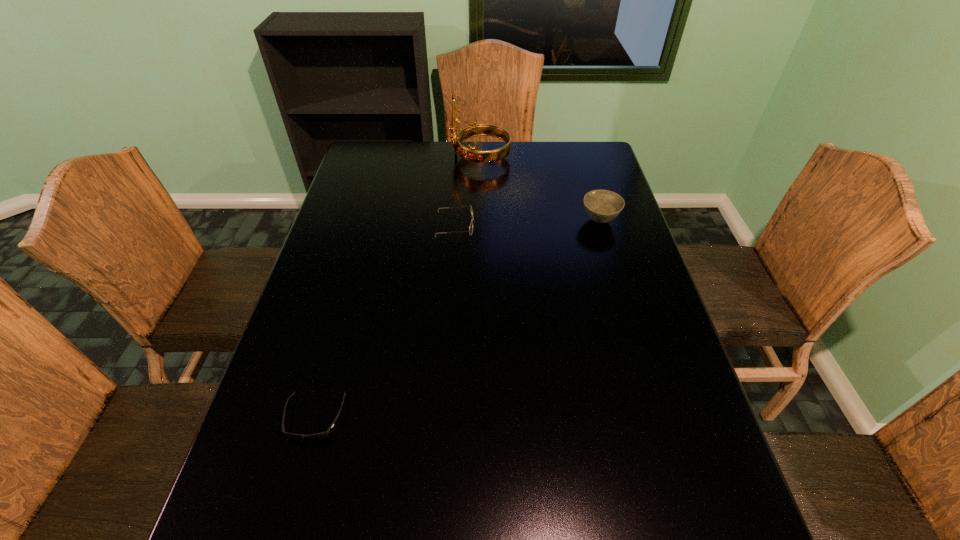
Locate an element on the screen. vacant space that's between the farthest object and the third tallest object is located at coordinates (468, 191).

Locate which object ranks in proximity to the bowl. Please provide its 2D coordinates. Your answer should be formatted as a tuple, i.e. [(x, y)], where the tuple contains the x and y coordinates of a point satisfying the conditions above.

[(473, 130)]

Identify which object is the third closest to the tiara. Please provide its 2D coordinates. Your answer should be formatted as a tuple, i.e. [(x, y)], where the tuple contains the x and y coordinates of a point satisfying the conditions above.

[(324, 434)]

I want to click on free spot that satisfies the following two spatial constraints: 1. on the front-facing side of the second shortest object; 2. on the front-facing side of the shortest object, so click(x=444, y=417).

Find the location of a particular element. vacant region that satisfies the following two spatial constraints: 1. on the front-facing side of the tiara; 2. on the right side of the bowl is located at coordinates (480, 220).

At what (x,y) coordinates should I click in order to perform the action: click on vacant position in the image that satisfies the following two spatial constraints: 1. on the front-facing side of the spectacles; 2. on the front-facing side of the shortest object. Please return your answer as a coordinate pair (x, y). Looking at the image, I should click on (444, 417).

Where is `free space that satisfies the following two spatial constraints: 1. on the front-facing side of the farthest object; 2. on the front-facing side of the leftmost object`? free space that satisfies the following two spatial constraints: 1. on the front-facing side of the farthest object; 2. on the front-facing side of the leftmost object is located at coordinates (481, 417).

The image size is (960, 540). What are the coordinates of `vacant region that satisfies the following two spatial constraints: 1. on the front-facing side of the spectacles; 2. on the front-facing side of the shortest object` in the screenshot? It's located at pyautogui.click(x=444, y=417).

You are a GUI agent. You are given a task and a screenshot of the screen. Output one action in this format:
    pyautogui.click(x=<x>, y=<y>)
    Task: Click on the free space that satisfies the following two spatial constraints: 1. on the front-facing side of the spectacles; 2. on the front-facing side of the sunglasses
    The width and height of the screenshot is (960, 540).
    Given the screenshot: What is the action you would take?
    pyautogui.click(x=444, y=417)

You are a GUI agent. You are given a task and a screenshot of the screen. Output one action in this format:
    pyautogui.click(x=<x>, y=<y>)
    Task: Click on the vacant space that satisfies the following two spatial constraints: 1. on the front-facing side of the farthest object; 2. on the front-facing side of the leftmost object
    This screenshot has height=540, width=960.
    Given the screenshot: What is the action you would take?
    481,417